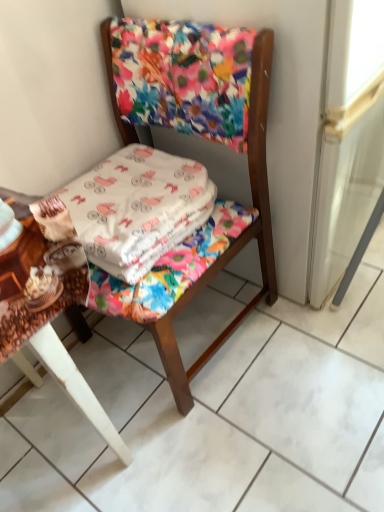
Question: Is white cotton blanket at center oriented away from floral fabric chair at center?

Choices:
 (A) yes
 (B) no

Answer: (A)

Question: Does white cotton blanket at center have a larger size compared to floral fabric chair at center?

Choices:
 (A) no
 (B) yes

Answer: (A)

Question: Is white cotton blanket at center at the right side of floral fabric chair at center?

Choices:
 (A) yes
 (B) no

Answer: (B)

Question: From the image's perspective, would you say white cotton blanket at center is shown under floral fabric chair at center?

Choices:
 (A) no
 (B) yes

Answer: (A)

Question: Is white cotton blanket at center far from floral fabric chair at center?

Choices:
 (A) no
 (B) yes

Answer: (A)

Question: Considering the positions of wooden table at lower left and white cotton blanket at center in the image, is wooden table at lower left taller or shorter than white cotton blanket at center?

Choices:
 (A) short
 (B) tall

Answer: (B)

Question: From a real-world perspective, is wooden table at lower left positioned above or below white cotton blanket at center?

Choices:
 (A) below
 (B) above

Answer: (A)

Question: Considering the positions of wooden table at lower left and white cotton blanket at center in the image, is wooden table at lower left bigger or smaller than white cotton blanket at center?

Choices:
 (A) big
 (B) small

Answer: (A)

Question: Is wooden table at lower left spatially inside white cotton blanket at center, or outside of it?

Choices:
 (A) outside
 (B) inside

Answer: (A)

Question: Do you think wooden table at lower left is within floral fabric screen door at upper center, or outside of it?

Choices:
 (A) outside
 (B) inside

Answer: (A)

Question: Is point (66, 303) closer or farther from the camera than point (211, 22)?

Choices:
 (A) closer
 (B) farther

Answer: (A)

Question: Looking at the image, does wooden table at lower left seem bigger or smaller compared to floral fabric screen door at upper center?

Choices:
 (A) big
 (B) small

Answer: (B)

Question: Is wooden table at lower left in front of or behind floral fabric screen door at upper center in the image?

Choices:
 (A) behind
 (B) front

Answer: (B)

Question: Do you think white cotton blanket at center is within floral fabric chair at center, or outside of it?

Choices:
 (A) inside
 (B) outside

Answer: (A)

Question: From a real-world perspective, is white cotton blanket at center above or below floral fabric chair at center?

Choices:
 (A) below
 (B) above

Answer: (B)